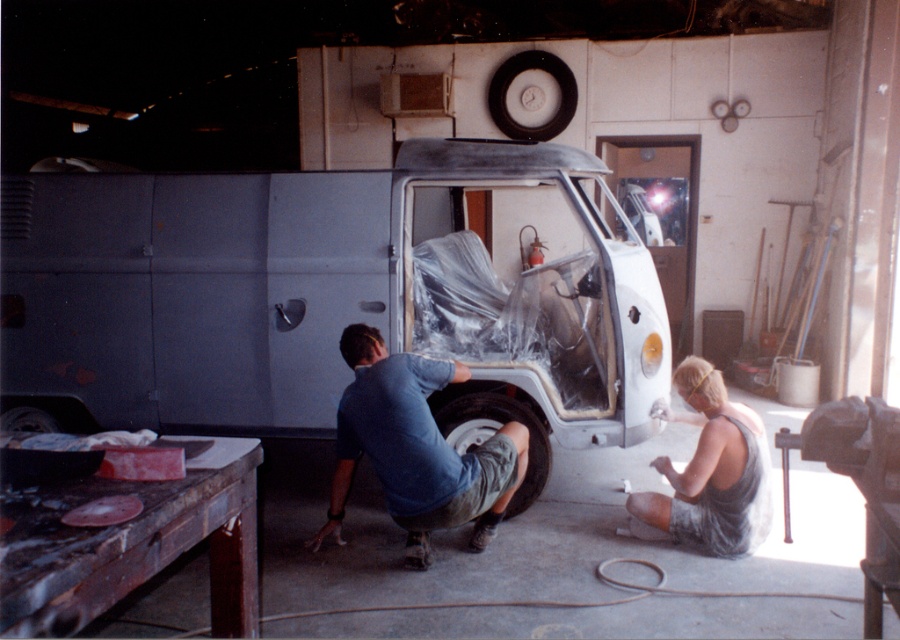
Question: Does metallic silver van at center have a lesser width compared to rusty wood workbench at lower left?

Choices:
 (A) no
 (B) yes

Answer: (A)

Question: Is rusty wood workbench at lower left smaller than blue cotton shirt at lower center?

Choices:
 (A) yes
 (B) no

Answer: (A)

Question: Which point is farther to the camera?

Choices:
 (A) black rubber tire at lower center
 (B) blue cotton shirt at lower center
 (C) metallic silver van at center
 (D) rusty wood workbench at lower left

Answer: (A)

Question: Which point appears closest to the camera in this image?

Choices:
 (A) (22, 525)
 (B) (767, 524)
 (C) (435, 435)

Answer: (A)

Question: Which of the following is the farthest from the observer?

Choices:
 (A) (522, 472)
 (B) (465, 422)

Answer: (B)

Question: Is rusty wood workbench at lower left bigger than black rubber tire at lower center?

Choices:
 (A) no
 (B) yes

Answer: (B)